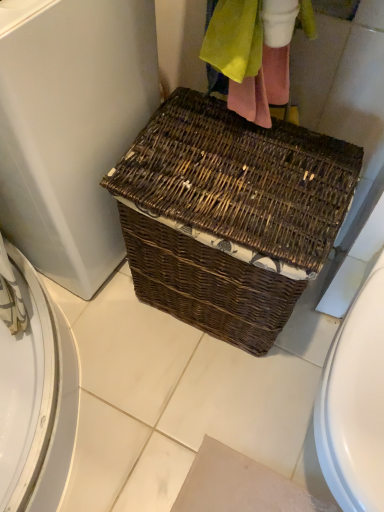
Question: Is brown wicker basket at center positioned far away from brown wicker basket at center?

Choices:
 (A) no
 (B) yes

Answer: (A)

Question: From the image's perspective, is brown wicker basket at center under brown wicker basket at center?

Choices:
 (A) no
 (B) yes

Answer: (A)

Question: Is brown wicker basket at center placed right next to brown wicker basket at center?

Choices:
 (A) yes
 (B) no

Answer: (B)

Question: From a real-world perspective, is brown wicker basket at center physically below brown wicker basket at center?

Choices:
 (A) no
 (B) yes

Answer: (A)

Question: Does brown wicker basket at center have a smaller size compared to brown wicker basket at center?

Choices:
 (A) yes
 (B) no

Answer: (B)

Question: Can you confirm if brown wicker basket at center is positioned to the right of brown wicker basket at center?

Choices:
 (A) yes
 (B) no

Answer: (B)

Question: From the image's perspective, is brown wicker basket at center beneath brown wicker basket at center?

Choices:
 (A) no
 (B) yes

Answer: (B)

Question: From a real-world perspective, is brown wicker basket at center beneath brown wicker basket at center?

Choices:
 (A) no
 (B) yes

Answer: (B)

Question: Does brown wicker basket at center have a greater height compared to brown wicker basket at center?

Choices:
 (A) yes
 (B) no

Answer: (B)

Question: Does brown wicker basket at center have a lesser height compared to brown wicker basket at center?

Choices:
 (A) no
 (B) yes

Answer: (B)

Question: Is the depth of brown wicker basket at center less than that of brown wicker basket at center?

Choices:
 (A) yes
 (B) no

Answer: (B)

Question: Is brown wicker basket at center positioned far away from brown wicker basket at center?

Choices:
 (A) yes
 (B) no

Answer: (B)

Question: From the image's perspective, is brown wicker basket at center located above or below brown wicker basket at center?

Choices:
 (A) below
 (B) above

Answer: (A)